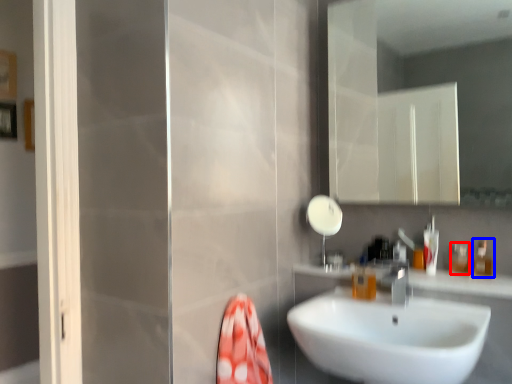
Question: Which object appears closest to the camera in this image, toiletry (highlighted by a red box) or toiletry (highlighted by a blue box)?

Choices:
 (A) toiletry
 (B) toiletry

Answer: (B)